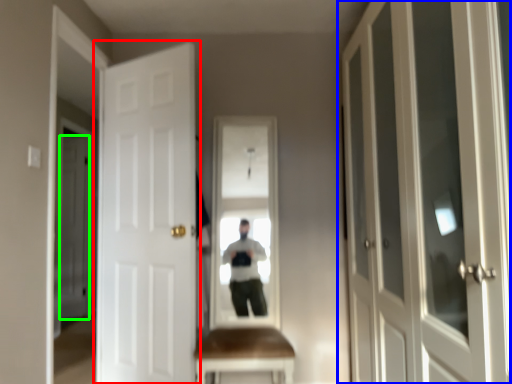
Question: Estimate the real-world distances between objects in this image. Which object is farther from door (highlighted by a red box), door (highlighted by a blue box) or door (highlighted by a green box)?

Choices:
 (A) door
 (B) door

Answer: (B)